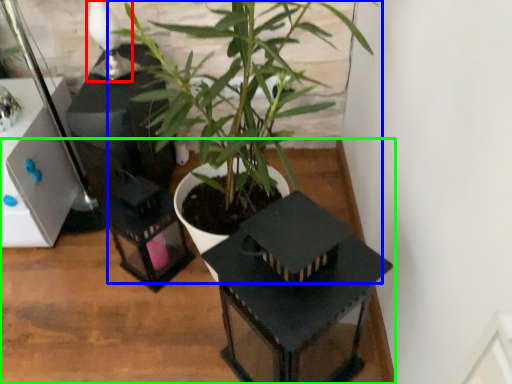
Question: Which is farther away from table lamp (highlighted by a red box)? houseplant (highlighted by a blue box) or table (highlighted by a green box)?

Choices:
 (A) houseplant
 (B) table

Answer: (B)